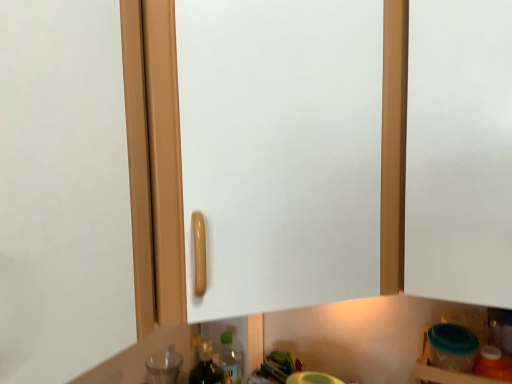
Image resolution: width=512 pixels, height=384 pixels. I want to click on transparent glass bottle at lower left, marked as the second bottle in a front-to-back arrangement, so click(x=164, y=366).

What do you see at coordinates (164, 366) in the screenshot?
I see `transparent glass bottle at lower left, marked as the second bottle in a front-to-back arrangement` at bounding box center [164, 366].

Find the location of a particular element. The width and height of the screenshot is (512, 384). translucent orange bottle at lower right, the 1th bottle viewed from the front is located at coordinates (493, 364).

What do you see at coordinates (493, 364) in the screenshot? The width and height of the screenshot is (512, 384). I see `translucent orange bottle at lower right, the second bottle in the left-to-right sequence` at bounding box center [493, 364].

How much space does translucent orange bottle at lower right, arranged as the second bottle when viewed from the back, occupy vertically?

6.24 inches.

Identify the location of transparent glass bottle at lower left, the first bottle viewed from the left. (164, 366).

Between transparent glass bottle at lower left, which ranks as the 1th bottle in back-to-front order, and translucent orange bottle at lower right, the 1th bottle positioned from the right, which one appears on the left side from the viewer's perspective?

transparent glass bottle at lower left, which ranks as the 1th bottle in back-to-front order, is more to the left.

From the picture: Which object is further away from the camera taking this photo, transparent glass bottle at lower left, which appears as the 2th bottle when viewed from the right, or translucent orange bottle at lower right, the 1th bottle positioned from the right?

transparent glass bottle at lower left, which appears as the 2th bottle when viewed from the right, is further away from the camera.

Is point (172, 349) closer to viewer compared to point (476, 363)?

No, it is behind (476, 363).

Looking at this image, from the image's perspective, which is above, transparent glass bottle at lower left, which appears as the 2th bottle when viewed from the right, or translucent orange bottle at lower right, the 1th bottle positioned from the right?

translucent orange bottle at lower right, the 1th bottle positioned from the right, from the image's perspective.

From a real-world perspective, which object rests below the other?

transparent glass bottle at lower left, marked as the second bottle in a front-to-back arrangement, from a real-world perspective.

Which object is thinner, transparent glass bottle at lower left, which appears as the 2th bottle when viewed from the right, or translucent orange bottle at lower right, the second bottle in the left-to-right sequence?

Thinner between the two is translucent orange bottle at lower right, the second bottle in the left-to-right sequence.

Considering the relative sizes of transparent glass bottle at lower left, which ranks as the 1th bottle in back-to-front order, and translucent orange bottle at lower right, arranged as the second bottle when viewed from the back, in the image provided, is transparent glass bottle at lower left, which ranks as the 1th bottle in back-to-front order, taller than translucent orange bottle at lower right, arranged as the second bottle when viewed from the back,?

Indeed, transparent glass bottle at lower left, which ranks as the 1th bottle in back-to-front order, has a greater height compared to translucent orange bottle at lower right, arranged as the second bottle when viewed from the back.

Is transparent glass bottle at lower left, marked as the second bottle in a front-to-back arrangement, bigger than translucent orange bottle at lower right, the second bottle in the left-to-right sequence?

Yes, transparent glass bottle at lower left, marked as the second bottle in a front-to-back arrangement, is bigger than translucent orange bottle at lower right, the second bottle in the left-to-right sequence.

Is transparent glass bottle at lower left, the first bottle viewed from the left, inside or outside of translucent orange bottle at lower right, the second bottle in the left-to-right sequence?

transparent glass bottle at lower left, the first bottle viewed from the left, is not inside translucent orange bottle at lower right, the second bottle in the left-to-right sequence, it's outside.

Is transparent glass bottle at lower left, marked as the second bottle in a front-to-back arrangement, positioned far away from translucent orange bottle at lower right, the 1th bottle positioned from the right?

Actually, transparent glass bottle at lower left, marked as the second bottle in a front-to-back arrangement, and translucent orange bottle at lower right, the 1th bottle positioned from the right, are a little close together.

Is transparent glass bottle at lower left, which ranks as the 1th bottle in back-to-front order, oriented away from translucent orange bottle at lower right, arranged as the second bottle when viewed from the back?

No.

How different are the orientations of transparent glass bottle at lower left, which appears as the 2th bottle when viewed from the right, and translucent orange bottle at lower right, the second bottle in the left-to-right sequence, in degrees?

The angular difference between transparent glass bottle at lower left, which appears as the 2th bottle when viewed from the right, and translucent orange bottle at lower right, the second bottle in the left-to-right sequence, is 29.9 degrees.

This screenshot has height=384, width=512. I want to click on bottle in front of the transparent glass bottle at lower left, marked as the second bottle in a front-to-back arrangement, so click(x=493, y=364).

Is translucent orange bottle at lower right, the 1th bottle viewed from the front, to the left or to the right of transparent glass bottle at lower left, which appears as the 2th bottle when viewed from the right, in the image?

translucent orange bottle at lower right, the 1th bottle viewed from the front, is to the right of transparent glass bottle at lower left, which appears as the 2th bottle when viewed from the right.

Is translucent orange bottle at lower right, the second bottle in the left-to-right sequence, behind transparent glass bottle at lower left, the first bottle viewed from the left?

No, it is not.

Which point is more forward, (508, 371) or (160, 360)?

The point (508, 371) is closer to the camera.

From the image's perspective, would you say translucent orange bottle at lower right, the 1th bottle viewed from the front, is positioned over transparent glass bottle at lower left, marked as the second bottle in a front-to-back arrangement?

Yes, from the image's perspective, translucent orange bottle at lower right, the 1th bottle viewed from the front, is above transparent glass bottle at lower left, marked as the second bottle in a front-to-back arrangement.

In the scene shown: From a real-world perspective, is translucent orange bottle at lower right, the 1th bottle viewed from the front, beneath transparent glass bottle at lower left, which ranks as the 1th bottle in back-to-front order?

No, from a real-world perspective, translucent orange bottle at lower right, the 1th bottle viewed from the front, is not beneath transparent glass bottle at lower left, which ranks as the 1th bottle in back-to-front order.

Consider the image. Between translucent orange bottle at lower right, arranged as the second bottle when viewed from the back, and transparent glass bottle at lower left, which appears as the 2th bottle when viewed from the right, which one has smaller width?

translucent orange bottle at lower right, arranged as the second bottle when viewed from the back.

Consider the image. Considering the relative sizes of translucent orange bottle at lower right, the 1th bottle positioned from the right, and transparent glass bottle at lower left, the first bottle viewed from the left, in the image provided, is translucent orange bottle at lower right, the 1th bottle positioned from the right, taller than transparent glass bottle at lower left, the first bottle viewed from the left,?

In fact, translucent orange bottle at lower right, the 1th bottle positioned from the right, may be shorter than transparent glass bottle at lower left, the first bottle viewed from the left.

Based on the photo, does translucent orange bottle at lower right, arranged as the second bottle when viewed from the back, have a smaller size compared to transparent glass bottle at lower left, the first bottle viewed from the left?

Yes.

Would you say translucent orange bottle at lower right, the 1th bottle positioned from the right, is outside transparent glass bottle at lower left, which appears as the 2th bottle when viewed from the right?

Indeed, translucent orange bottle at lower right, the 1th bottle positioned from the right, is completely outside transparent glass bottle at lower left, which appears as the 2th bottle when viewed from the right.

Is translucent orange bottle at lower right, the second bottle in the left-to-right sequence, placed right next to transparent glass bottle at lower left, which ranks as the 1th bottle in back-to-front order?

No, translucent orange bottle at lower right, the second bottle in the left-to-right sequence, is not with transparent glass bottle at lower left, which ranks as the 1th bottle in back-to-front order.

Is translucent orange bottle at lower right, the 1th bottle viewed from the front, facing away from transparent glass bottle at lower left, marked as the second bottle in a front-to-back arrangement?

translucent orange bottle at lower right, the 1th bottle viewed from the front, does not have its back to transparent glass bottle at lower left, marked as the second bottle in a front-to-back arrangement.

Could you measure the distance between translucent orange bottle at lower right, the second bottle in the left-to-right sequence, and transparent glass bottle at lower left, which ranks as the 1th bottle in back-to-front order?

The distance of translucent orange bottle at lower right, the second bottle in the left-to-right sequence, from transparent glass bottle at lower left, which ranks as the 1th bottle in back-to-front order, is 67.50 centimeters.

I want to click on bottle that appears below the translucent orange bottle at lower right, the 1th bottle viewed from the front (from the image's perspective), so click(x=164, y=366).

This screenshot has width=512, height=384. Identify the location of bottle below the translucent orange bottle at lower right, arranged as the second bottle when viewed from the back (from a real-world perspective). (164, 366).

You are a GUI agent. You are given a task and a screenshot of the screen. Output one action in this format:
    pyautogui.click(x=<x>, y=<y>)
    Task: Click on the bottle behind the translucent orange bottle at lower right, the second bottle in the left-to-right sequence
    Image resolution: width=512 pixels, height=384 pixels.
    Given the screenshot: What is the action you would take?
    click(x=164, y=366)